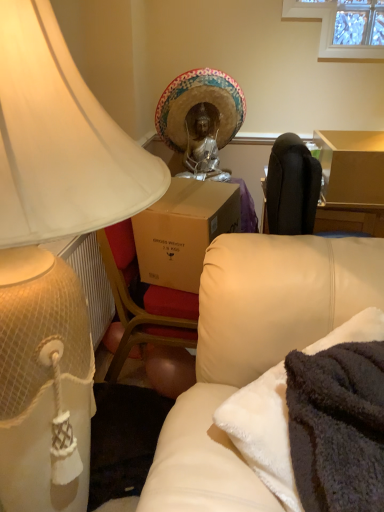
Question: From the image's perspective, is matte white lampshade at left positioned above or below soft cream leather couch at lower right?

Choices:
 (A) below
 (B) above

Answer: (B)

Question: From a real-world perspective, is matte white lampshade at left above or below soft cream leather couch at lower right?

Choices:
 (A) above
 (B) below

Answer: (A)

Question: Estimate the real-world distances between objects in this image. Which object is closer to the soft cream leather couch at lower right?

Choices:
 (A) matte white lampshade at left
 (B) gold textured headdress at center

Answer: (A)

Question: Which of these objects is positioned closest to the matte white lampshade at left?

Choices:
 (A) gold textured headdress at center
 (B) soft cream leather couch at lower right

Answer: (B)